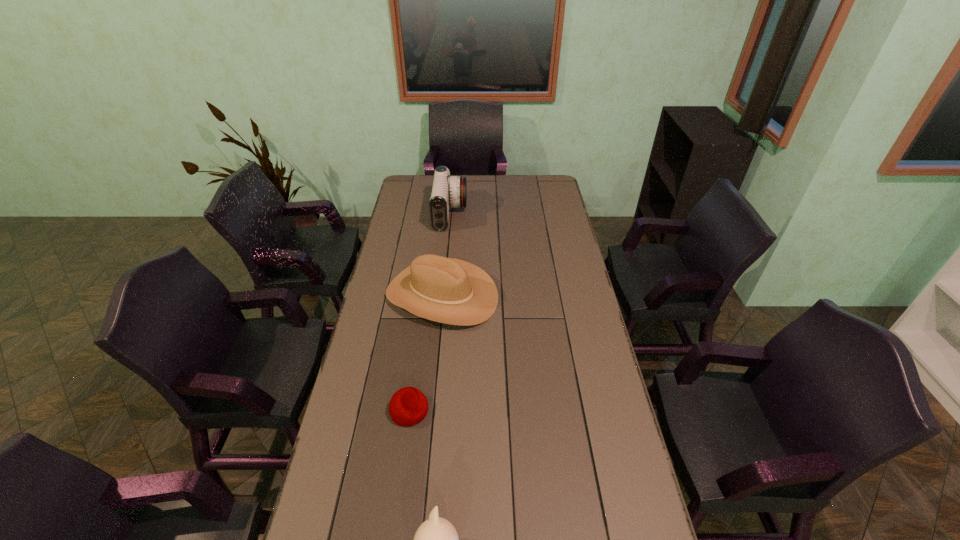
Identify the location of vacant space that satisfies the following two spatial constraints: 1. on the front side of the third shortest object; 2. on the seat area of the second nearest object. The image size is (960, 540). (431, 410).

Image resolution: width=960 pixels, height=540 pixels. In order to click on vacant region that satisfies the following two spatial constraints: 1. on the front side of the third shortest object; 2. on the seat area of the shortest object in this screenshot , I will do `click(431, 410)`.